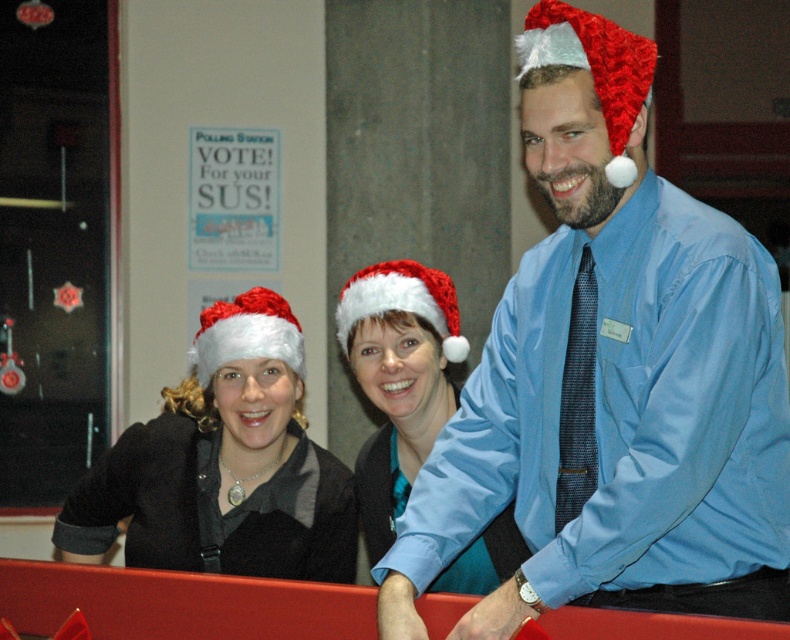
Is white fuzzy santa hat at center positioned behind white fuzzy santa hat at left?

No, it is not.

Does white fuzzy santa hat at center appear over white fuzzy santa hat at left?

No, white fuzzy santa hat at center is not above white fuzzy santa hat at left.

Is point (450, 321) positioned in front of point (258, 304)?

Yes, point (450, 321) is in front of point (258, 304).

Identify the location of white fuzzy santa hat at center. The width and height of the screenshot is (790, 640). (397, 380).

Who is higher up, blue satin shirt at center or red knitted santa hat at upper right?

red knitted santa hat at upper right is above.

Who is shorter, blue satin shirt at center or red knitted santa hat at upper right?

red knitted santa hat at upper right

Describe the element at coordinates (611, 380) in the screenshot. I see `blue satin shirt at center` at that location.

The width and height of the screenshot is (790, 640). I want to click on blue satin shirt at center, so click(611, 380).

Is point (747, 384) farther from viewer compared to point (397, 268)?

No, it is in front of (397, 268).

Does blue satin shirt at center have a lesser height compared to white fluffy santa hat at center?

No.

Measure the distance between blue satin shirt at center and camera.

They are 6.90 feet apart.

Where is `blue satin shirt at center`? The height and width of the screenshot is (640, 790). blue satin shirt at center is located at coordinates (611, 380).